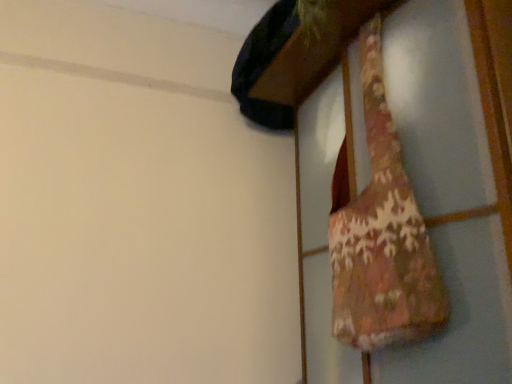
What is the approximate width of floral fabric purse at upper right?

floral fabric purse at upper right is 4.35 inches wide.

The image size is (512, 384). Describe the element at coordinates (381, 233) in the screenshot. I see `floral fabric purse at upper right` at that location.

Identify the location of floral fabric purse at upper right. This screenshot has width=512, height=384. (381, 233).

Locate an element on the screen. Image resolution: width=512 pixels, height=384 pixels. floral fabric purse at upper right is located at coordinates (381, 233).